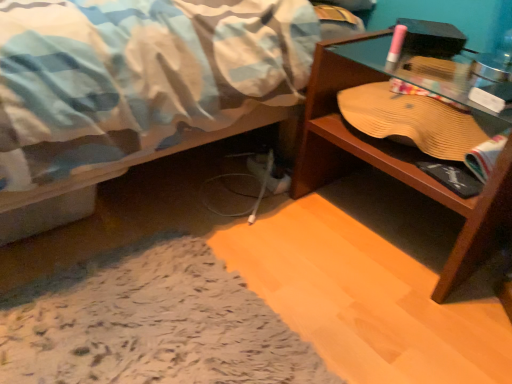
What do you see at coordinates (391, 162) in the screenshot? The height and width of the screenshot is (384, 512). I see `wooden desk at right` at bounding box center [391, 162].

Find the location of a particular element. Image resolution: width=512 pixels, height=384 pixels. wooden desk at right is located at coordinates (391, 162).

What do you see at coordinates (426, 75) in the screenshot?
I see `transparent glass table at right` at bounding box center [426, 75].

Measure the distance between transparent glass table at right and camera.

transparent glass table at right and camera are 33.34 inches apart.

The height and width of the screenshot is (384, 512). Find the location of `transparent glass table at right`. transparent glass table at right is located at coordinates (426, 75).

Locate an element on the screen. wooden desk at right is located at coordinates (391, 162).

Would you say transparent glass table at right is to the left or to the right of wooden desk at right in the picture?

transparent glass table at right is positioned on wooden desk at right's left side.

Who is more distant, transparent glass table at right or wooden desk at right?

transparent glass table at right is more distant.

Between point (365, 65) and point (483, 200), which one is positioned behind?

The point (365, 65) is more distant.

From the image's perspective, is transparent glass table at right under wooden desk at right?

Incorrect, from the image's perspective, transparent glass table at right is higher than wooden desk at right.

From a real-world perspective, which object stands above the other?

transparent glass table at right.

Does transparent glass table at right have a greater width compared to wooden desk at right?

No, transparent glass table at right is not wider than wooden desk at right.

Which of these two, transparent glass table at right or wooden desk at right, stands shorter?

transparent glass table at right is shorter.

Considering the relative sizes of transparent glass table at right and wooden desk at right in the image provided, is transparent glass table at right bigger than wooden desk at right?

No, transparent glass table at right is not bigger than wooden desk at right.

Is wooden desk at right surrounded by transparent glass table at right?

Definitely not — wooden desk at right is not inside transparent glass table at right.

Is transparent glass table at right touching wooden desk at right?

No.

Is transparent glass table at right positioned with its back to wooden desk at right?

Yes, transparent glass table at right is positioned with its back facing wooden desk at right.

What's the angular difference between transparent glass table at right and wooden desk at right's facing directions?

They differ by 0.000103 degrees in their facing directions.

Measure the distance between transparent glass table at right and wooden desk at right.

transparent glass table at right is 6.49 inches from wooden desk at right.

This screenshot has height=384, width=512. I want to click on glass table on the left of wooden desk at right, so click(426, 75).

Does wooden desk at right appear on the left side of transparent glass table at right?

No, wooden desk at right is not to the left of transparent glass table at right.

Consider the image. Is the depth of wooden desk at right less than that of transparent glass table at right?

Yes, it is in front of transparent glass table at right.

Is point (406, 164) farther from viewer compared to point (483, 116)?

No.

From the picture: From the image's perspective, who appears lower, wooden desk at right or transparent glass table at right?

From the image's view, wooden desk at right is below.

From a real-world perspective, is wooden desk at right above or below transparent glass table at right?

wooden desk at right is situated lower than transparent glass table at right in the real world.

Which object is wider, wooden desk at right or transparent glass table at right?

wooden desk at right.

Considering the relative sizes of wooden desk at right and transparent glass table at right in the image provided, is wooden desk at right taller than transparent glass table at right?

Yes, wooden desk at right is taller than transparent glass table at right.

Who is bigger, wooden desk at right or transparent glass table at right?

wooden desk at right is bigger.

Is transparent glass table at right located within wooden desk at right?

Yes, transparent glass table at right is inside wooden desk at right.

From the picture: Is wooden desk at right far away from transparent glass table at right?

No, wooden desk at right is not far away from transparent glass table at right.

In the scene shown: Is transparent glass table at right at the back of wooden desk at right?

Correct, wooden desk at right is looking away from transparent glass table at right.

How different are the orientations of wooden desk at right and transparent glass table at right in degrees?

There is a 0.000103-degree angle between the facing directions of wooden desk at right and transparent glass table at right.

You are a GUI agent. You are given a task and a screenshot of the screen. Output one action in this format:
    pyautogui.click(x=<x>, y=<y>)
    Task: Click on the glass table that appears behind the wooden desk at right
    
    Given the screenshot: What is the action you would take?
    (x=426, y=75)

This screenshot has width=512, height=384. There is a wooden desk at right. Find the location of `glass table above it (from a real-world perspective)`. glass table above it (from a real-world perspective) is located at coordinates (426, 75).

You are a GUI agent. You are given a task and a screenshot of the screen. Output one action in this format:
    pyautogui.click(x=<x>, y=<y>)
    Task: Click on the desk below the transparent glass table at right (from the image's perspective)
    
    Given the screenshot: What is the action you would take?
    pyautogui.click(x=391, y=162)